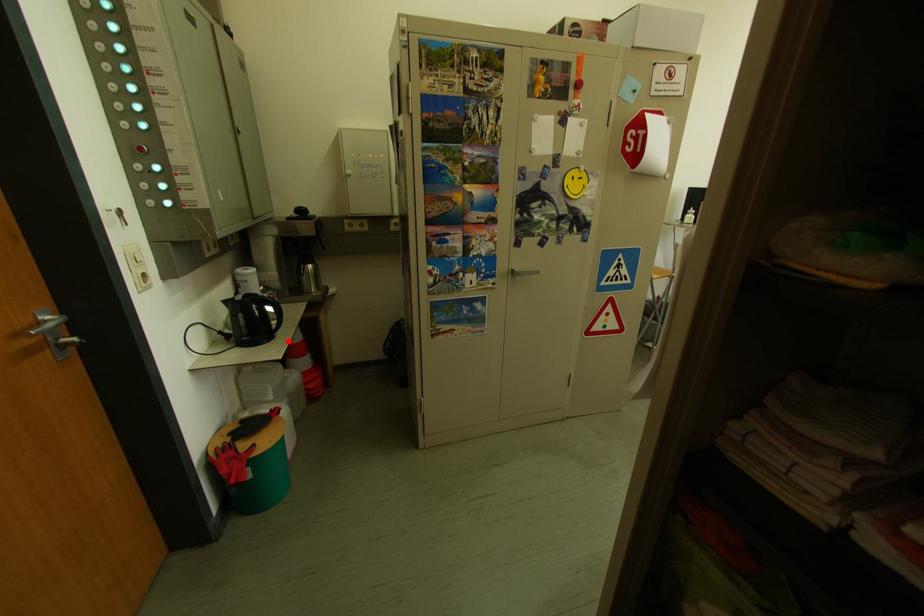
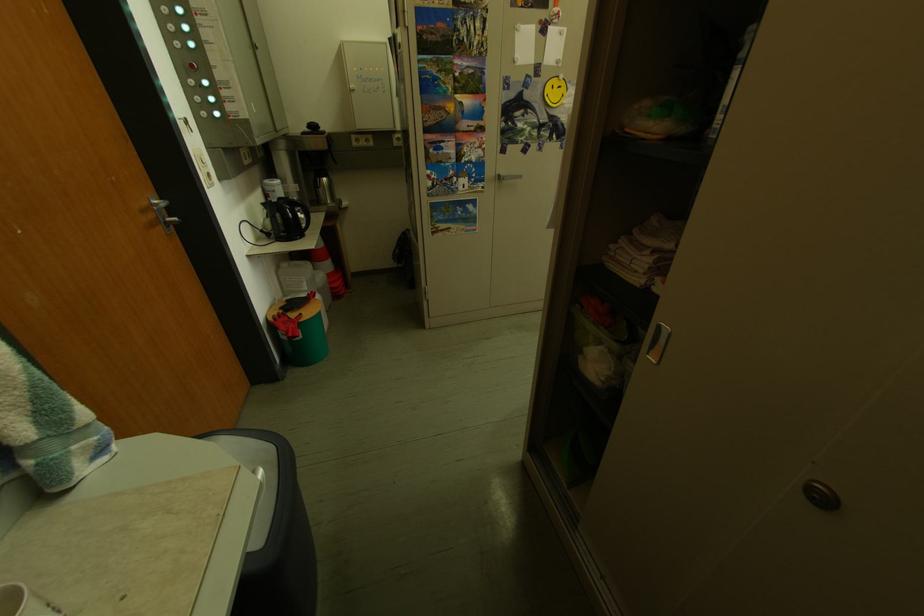
The point at the highlighted location is marked in the first image. Where is the corresponding point in the second image?

(319, 238)